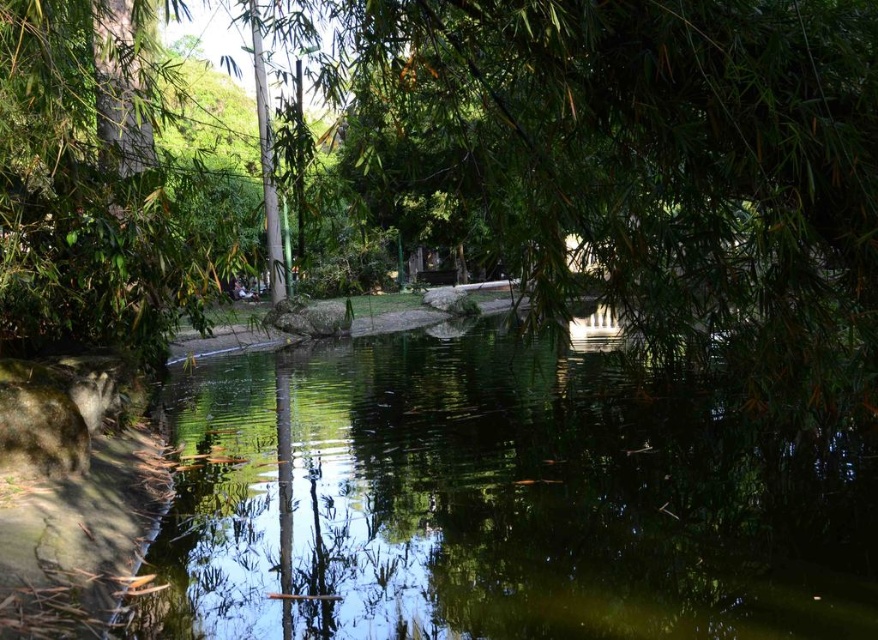
You are standing at the edge of the pond and want to see your reflection in the green reflective water at center. However, there is a green leafy tree at center blocking your view. Can you still see your reflection?

The green leafy tree at center is located above the green reflective water at center, so it may block part of the water surface. However, if you move to a position where the tree is not directly between you and the water, you might still see your reflection in the unobstructed areas of the green reflective water at center.

Consider the image. You are standing on the concrete edge of the pond on the left side. You want to reach the green leafy tree at center and the green reflective water at center. Which one is closer to you?

The green reflective water at center is closer to you because it is only 4.01 meters away from the green leafy tree at center, but since you are on the concrete edge, the water is directly in front of you while the tree is further away.